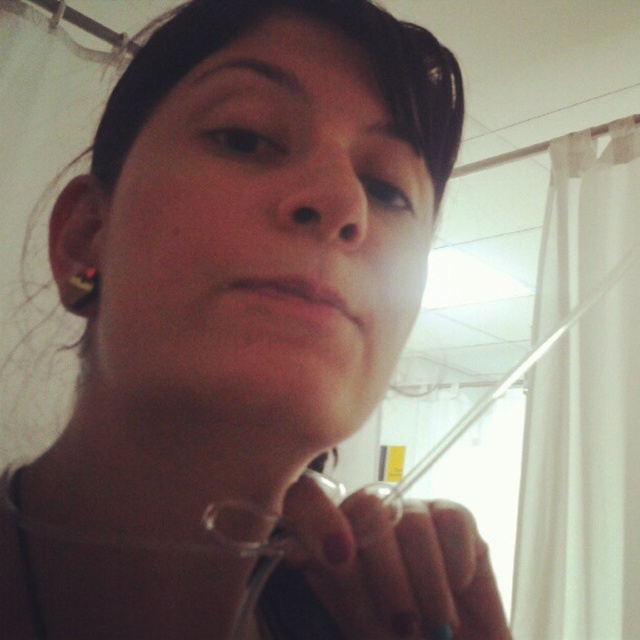
From the picture: You are a photographer adjusting the focus of your camera. The subject has a matte skin nose at center. Where should you focus to capture the nose clearly?

You should focus at point [323,198] to capture the matte skin nose at center clearly.

You are a photographer adjusting the lighting in the room. You notice the clear plastic tube at lower center and the matte skin nose at center. How far apart are these two items?

The clear plastic tube at lower center is 3.97 inches away from the matte skin nose at center.